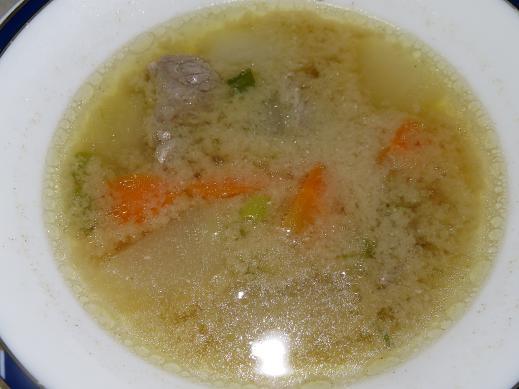
Find the location of a particular element. The height and width of the screenshot is (389, 519). light is located at coordinates (274, 358).